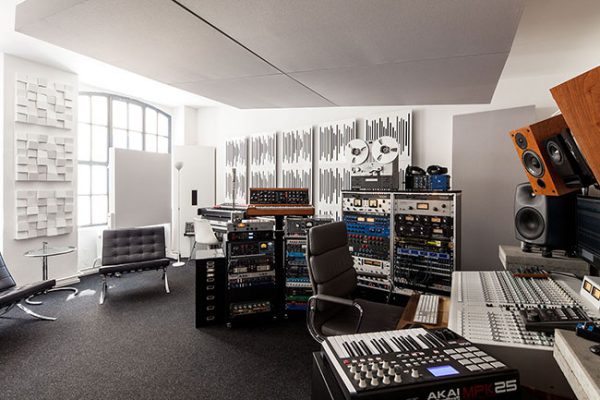
At what (x,y) coordinates should I click in order to perform the action: click on keyboard. Please return your answer as a coordinate pair (x, y). Looking at the image, I should click on (420, 358).